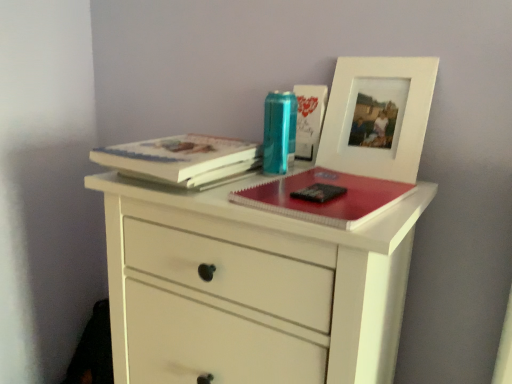
Question: Considering the positions of white matte picture frame at upper right and hardcover book at upper left, which is the 1th paperback book from left to right, in the image, is white matte picture frame at upper right wider or thinner than hardcover book at upper left, which is the 1th paperback book from left to right,?

Choices:
 (A) wide
 (B) thin

Answer: (B)

Question: Is white matte picture frame at upper right to the left or to the right of hardcover book at upper left, which is the 1th paperback book from left to right, in the image?

Choices:
 (A) left
 (B) right

Answer: (B)

Question: Estimate the real-world distances between objects in this image. Which object is closer to the hardcover book at upper left, marked as the 2th paperback book in a right-to-left arrangement?

Choices:
 (A) matte red notebook at center
 (B) white matte chest of drawers at center
 (C) white matte picture frame at upper right
 (D) hardcover book at upper right, positioned as the second paperback book in left-to-right order
 (E) translucent plastic can at center

Answer: (E)

Question: Based on their relative distances, which object is nearer to the white matte picture frame at upper right?

Choices:
 (A) white matte chest of drawers at center
 (B) hardcover book at upper right, positioned as the second paperback book in left-to-right order
 (C) hardcover book at upper left, which is the 1th paperback book from left to right
 (D) matte red notebook at center
 (E) translucent plastic can at center

Answer: (B)